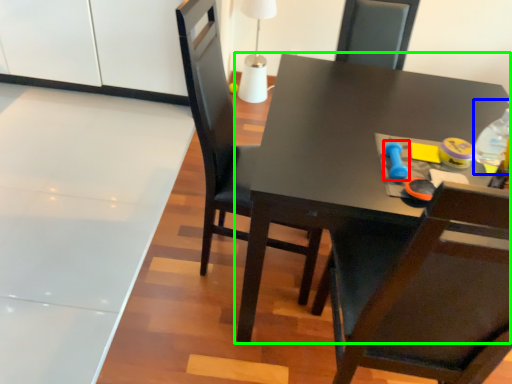
Question: Considering the real-world distances, which object is closest to toy (highlighted by a red box)? bottle (highlighted by a blue box) or table (highlighted by a green box).

Choices:
 (A) bottle
 (B) table

Answer: (A)